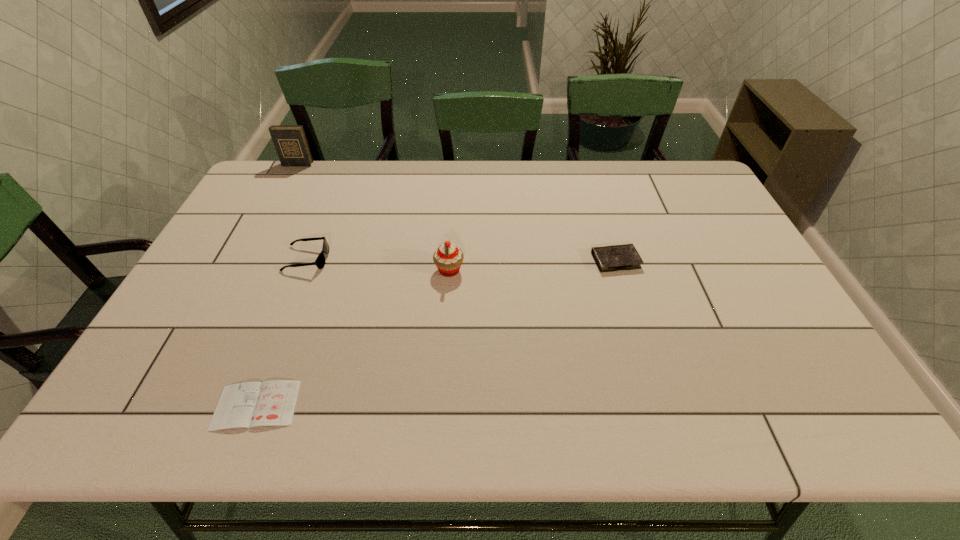
Where is `vacant area that lies between the third tallest object and the cupcake`? vacant area that lies between the third tallest object and the cupcake is located at coordinates 378,265.

You are a GUI agent. You are given a task and a screenshot of the screen. Output one action in this format:
    pyautogui.click(x=<x>, y=<y>)
    Task: Click on the vacant space that is in between the nearest object and the fourth object from left to right
    Image resolution: width=960 pixels, height=540 pixels.
    Given the screenshot: What is the action you would take?
    pyautogui.click(x=353, y=338)

This screenshot has height=540, width=960. I want to click on vacant area that lies between the sunglasses and the nearest diary, so tap(281, 332).

Locate an element on the screen. This screenshot has height=540, width=960. free area in between the fourth shortest object and the nearest object is located at coordinates (353, 338).

At what (x,y) coordinates should I click in order to perform the action: click on object that stands as the fourth closest to the second diary from left to right. Please return your answer as a coordinate pair (x, y). Image resolution: width=960 pixels, height=540 pixels. Looking at the image, I should click on (290, 141).

Find the location of a particular element. The height and width of the screenshot is (540, 960). object that is the fourth nearest to the fourth shortest object is located at coordinates (290, 141).

Locate which diary is the closest to the fourth shortest object. Please provide its 2D coordinates. Your answer should be formatted as a tuple, i.e. [(x, y)], where the tuple contains the x and y coordinates of a point satisfying the conditions above.

[(611, 258)]

Select which diary appears as the closest to the rightmost diary. Please provide its 2D coordinates. Your answer should be formatted as a tuple, i.e. [(x, y)], where the tuple contains the x and y coordinates of a point satisfying the conditions above.

[(272, 403)]

Find the location of a particular element. free spot that satisfies the following two spatial constraints: 1. on the front-facing side of the second shortest diary; 2. on the left side of the sunglasses is located at coordinates (306, 260).

You are a GUI agent. You are given a task and a screenshot of the screen. Output one action in this format:
    pyautogui.click(x=<x>, y=<y>)
    Task: Click on the free space in the image that satisfies the following two spatial constraints: 1. on the back side of the fourth object from left to right; 2. on the left side of the shortest object
    The image size is (960, 540).
    Given the screenshot: What is the action you would take?
    pyautogui.click(x=308, y=270)